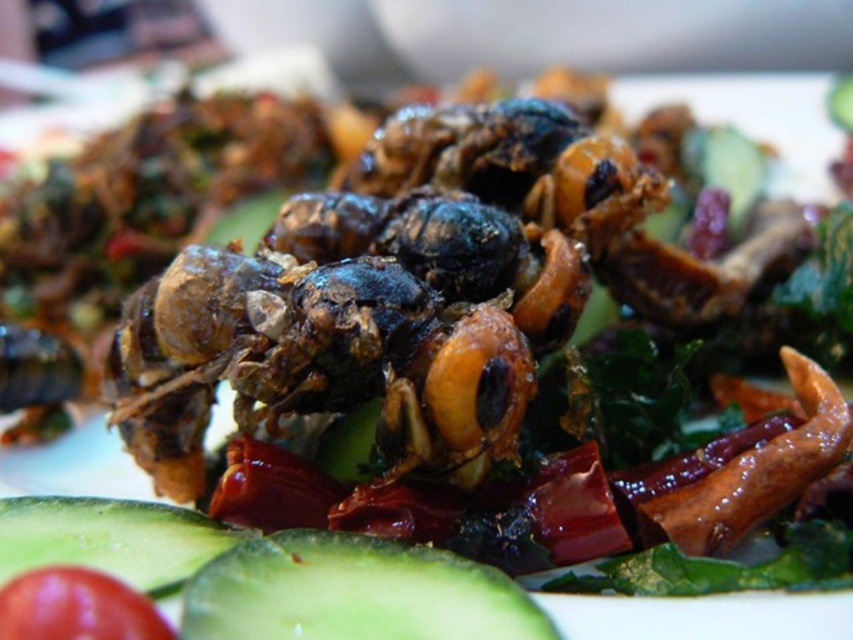
Is green smooth cucumber at lower left smaller than green matte cucumber at lower left?

Yes, green smooth cucumber at lower left is smaller than green matte cucumber at lower left.

Is green smooth cucumber at lower left further to the viewer compared to green matte cucumber at lower left?

That is False.

You are a GUI agent. You are given a task and a screenshot of the screen. Output one action in this format:
    pyautogui.click(x=<x>, y=<y>)
    Task: Click on the green smooth cucumber at lower left
    The height and width of the screenshot is (640, 853).
    Given the screenshot: What is the action you would take?
    pyautogui.click(x=352, y=593)

The height and width of the screenshot is (640, 853). I want to click on green smooth cucumber at lower left, so click(352, 593).

Can you confirm if green smooth cucumber at lower left is positioned to the right of red matte tomato at lower left?

Indeed, green smooth cucumber at lower left is positioned on the right side of red matte tomato at lower left.

Is point (514, 605) positioned before point (42, 602)?

No.

Where is `green smooth cucumber at lower left`? The width and height of the screenshot is (853, 640). green smooth cucumber at lower left is located at coordinates (352, 593).

Does green matte cucumber at lower left have a greater width compared to red matte tomato at lower left?

Yes, green matte cucumber at lower left is wider than red matte tomato at lower left.

Which is behind, point (190, 548) or point (102, 624)?

The point (190, 548) is more distant.

Which is in front, point (12, 509) or point (64, 624)?

Point (64, 624) is more forward.

Where is `green matte cucumber at lower left`? The image size is (853, 640). green matte cucumber at lower left is located at coordinates (111, 538).